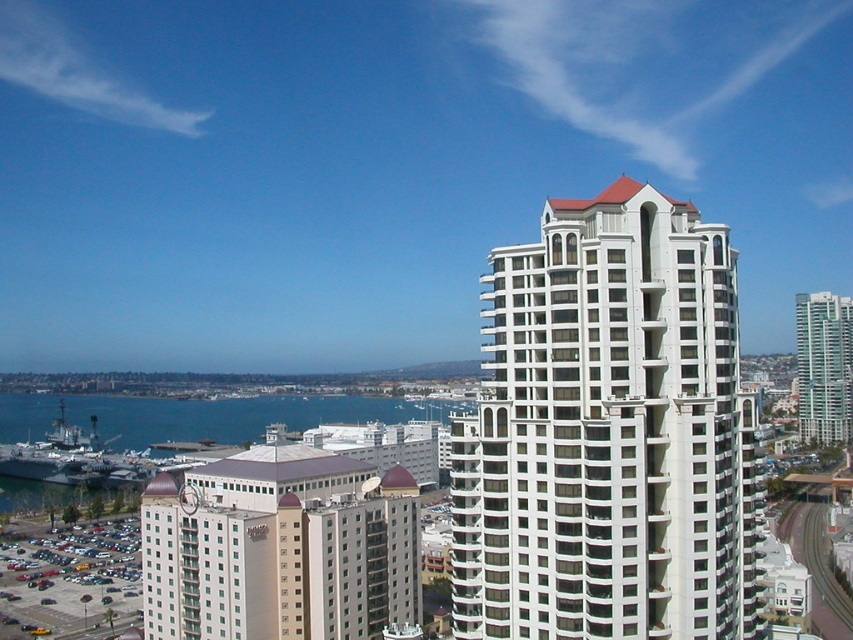
You are an architect evaluating the urban skyline. Which of the two buildings, the white glass building at center or the smooth glass skyscraper at right, would require a taller crane for construction?

The smooth glass skyscraper at right is taller than the white glass building at center, so it would require a taller crane for construction.